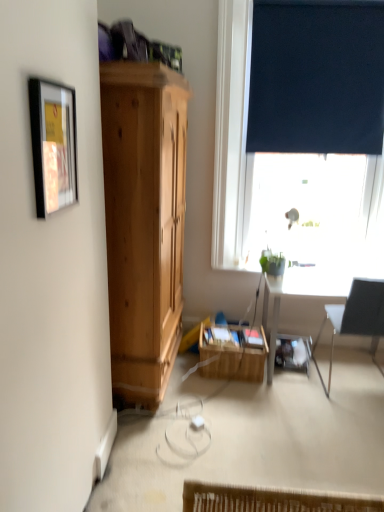
Question: Is dark blue roller blind at upper right facing away from black fabric chair at right?

Choices:
 (A) yes
 (B) no

Answer: (B)

Question: Considering the relative sizes of dark blue roller blind at upper right and black fabric chair at right in the image provided, is dark blue roller blind at upper right smaller than black fabric chair at right?

Choices:
 (A) yes
 (B) no

Answer: (B)

Question: Are dark blue roller blind at upper right and black fabric chair at right far apart?

Choices:
 (A) yes
 (B) no

Answer: (A)

Question: Is dark blue roller blind at upper right positioned behind black fabric chair at right?

Choices:
 (A) yes
 (B) no

Answer: (A)

Question: Is black fabric chair at right completely or partially inside dark blue roller blind at upper right?

Choices:
 (A) no
 (B) yes

Answer: (A)

Question: Considering their positions, is matte black picture frame at upper left located in front of or behind woven wood basket at center?

Choices:
 (A) front
 (B) behind

Answer: (A)

Question: From a real-world perspective, is matte black picture frame at upper left above or below woven wood basket at center?

Choices:
 (A) below
 (B) above

Answer: (B)

Question: Is point (71, 143) closer or farther from the camera than point (226, 353)?

Choices:
 (A) closer
 (B) farther

Answer: (A)

Question: Considering the positions of matte black picture frame at upper left and woven wood basket at center in the image, is matte black picture frame at upper left taller or shorter than woven wood basket at center?

Choices:
 (A) short
 (B) tall

Answer: (B)

Question: From the image's perspective, is green matte plant at window located above or below woven wood basket at center?

Choices:
 (A) above
 (B) below

Answer: (A)

Question: Relative to woven wood basket at center, is green matte plant at window in front or behind?

Choices:
 (A) front
 (B) behind

Answer: (A)

Question: Is green matte plant at window inside the boundaries of woven wood basket at center, or outside?

Choices:
 (A) outside
 (B) inside

Answer: (A)

Question: Considering the positions of green matte plant at window and woven wood basket at center in the image, is green matte plant at window bigger or smaller than woven wood basket at center?

Choices:
 (A) small
 (B) big

Answer: (A)

Question: From the image's perspective, is green matte plant at window positioned above or below dark blue roller blind at upper right?

Choices:
 (A) above
 (B) below

Answer: (B)

Question: In terms of width, does green matte plant at window look wider or thinner when compared to dark blue roller blind at upper right?

Choices:
 (A) thin
 (B) wide

Answer: (A)